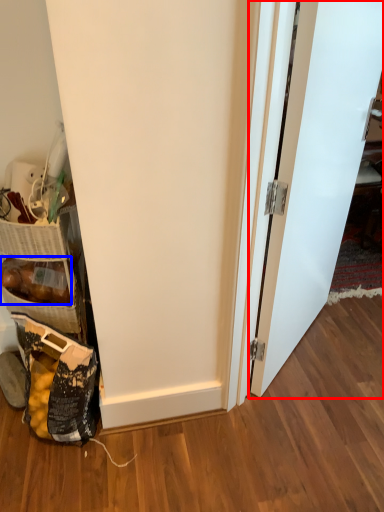
Question: Which point is closer to the camera, door (highlighted by a red box) or stuff (highlighted by a blue box)?

Choices:
 (A) door
 (B) stuff

Answer: (A)